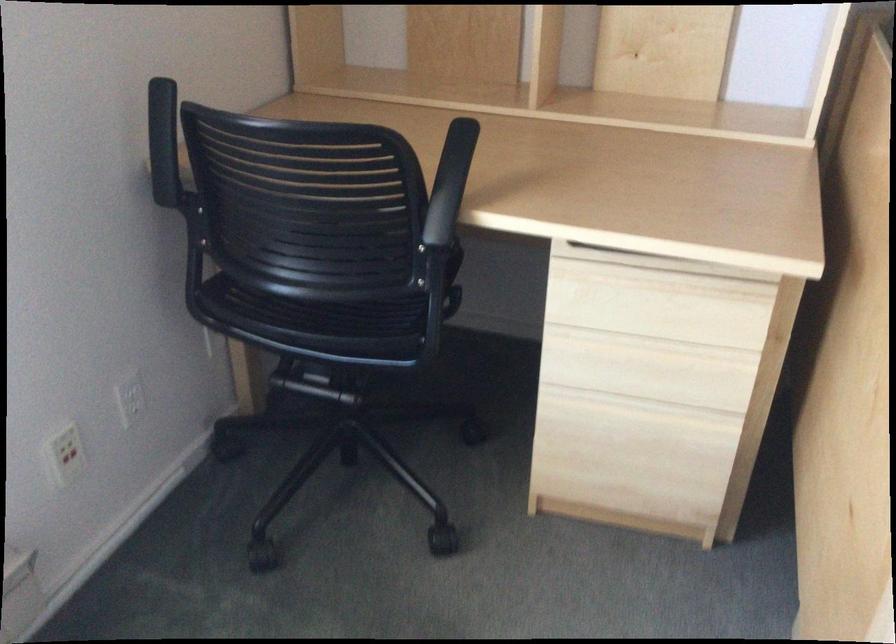
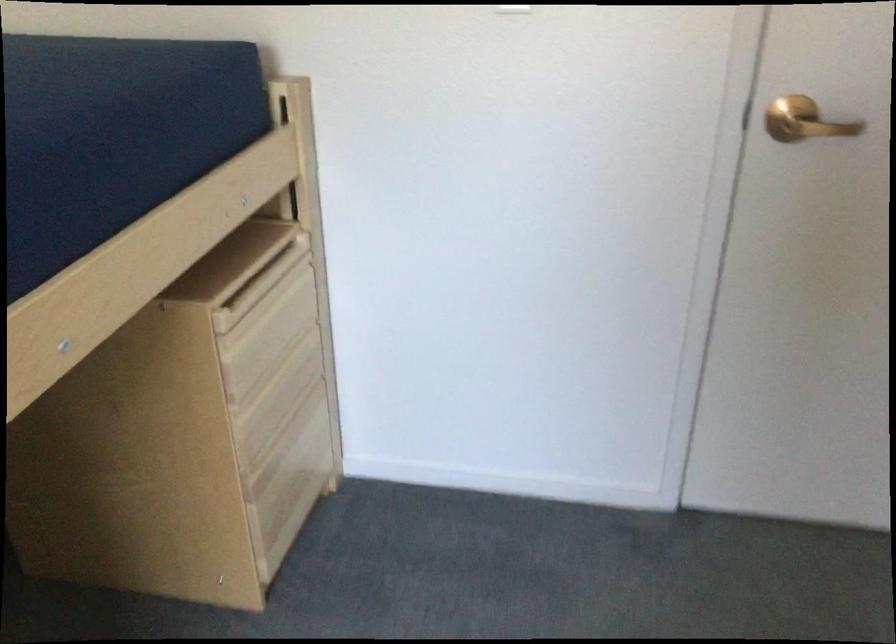
First-person continuous shooting, in which direction is the camera rotating?

The rotation direction of the camera is right-down.